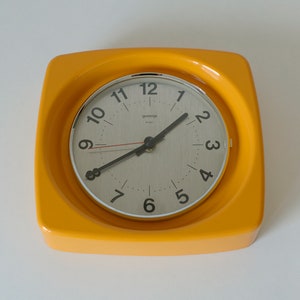
The image size is (300, 300). What are the coordinates of `upper left corner of clock` in the screenshot? It's located at (55, 61).